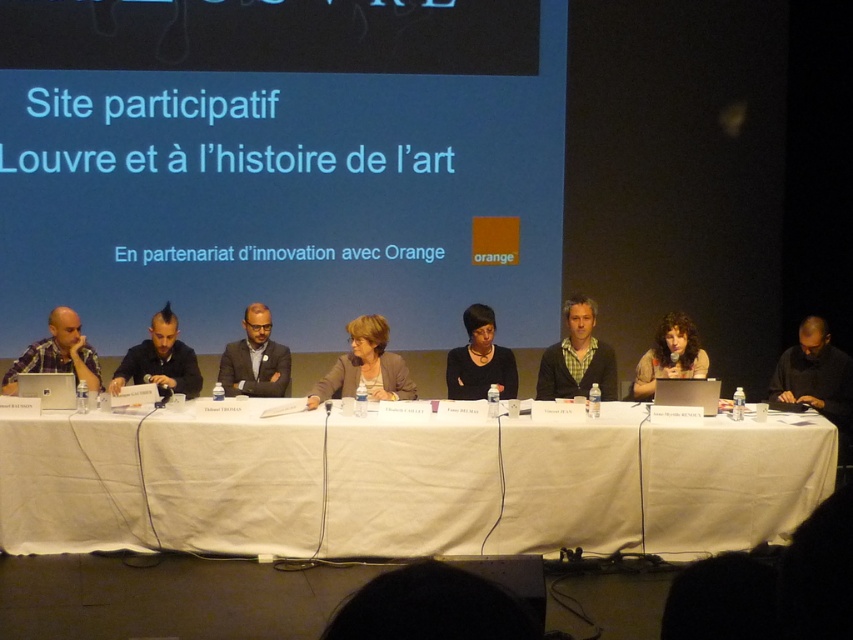
Is shiny black hair at center bigger than matte black suit at center?

Indeed, shiny black hair at center has a larger size compared to matte black suit at center.

Looking at this image, which is more to the left, shiny black hair at center or matte black suit at center?

shiny black hair at center is more to the left.

Which is behind, point (149, 381) or point (238, 364)?

Positioned behind is point (238, 364).

Identify the location of shiny black hair at center. (160, 360).

The height and width of the screenshot is (640, 853). In order to click on matte black hat at center in this screenshot , I will do `click(480, 360)`.

Is matte black hat at center taller than matte black suit at center?

Yes, matte black hat at center is taller than matte black suit at center.

Is point (500, 376) positioned before point (242, 372)?

Yes, it is in front of point (242, 372).

Where is `matte black hat at center`? Image resolution: width=853 pixels, height=640 pixels. matte black hat at center is located at coordinates (480, 360).

Between white fabric table at center and black matte shirt at center, which one appears on the right side from the viewer's perspective?

From the viewer's perspective, black matte shirt at center appears more on the right side.

Measure the distance between white fabric table at center and camera.

white fabric table at center is 4.67 meters away from camera.

Find the location of a particular element. white fabric table at center is located at coordinates (405, 483).